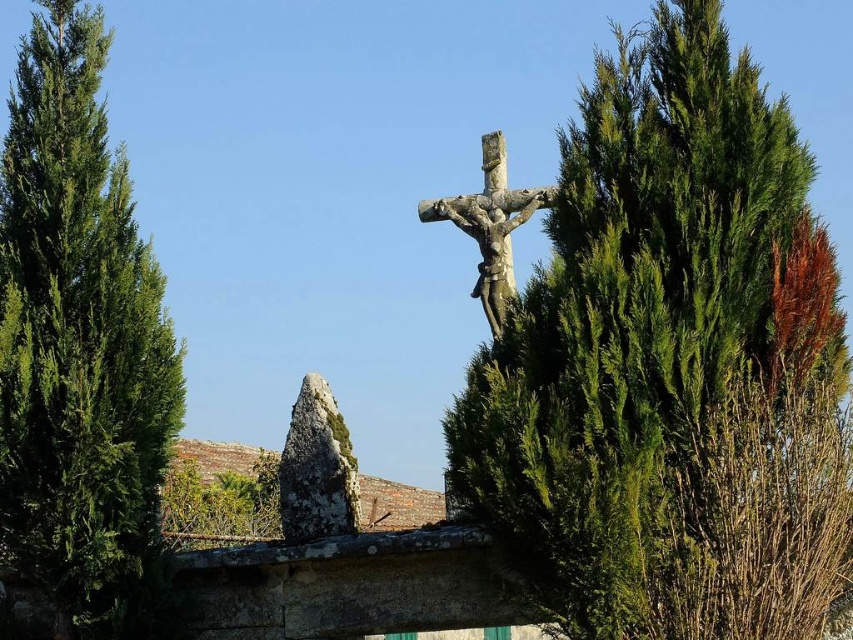
Which is more to the left, rough gray stone at center or stone statue at center?

rough gray stone at center

Which is behind, point (314, 429) or point (482, 266)?

The point (482, 266) is behind.

Locate an element on the screen. This screenshot has width=853, height=640. rough gray stone at center is located at coordinates (316, 467).

Is green textured tree at upper right shorter than stone statue at center?

No, green textured tree at upper right is not shorter than stone statue at center.

Between green textured tree at upper right and stone statue at center, which one is positioned lower?

Positioned lower is green textured tree at upper right.

Is point (805, 164) in front of point (512, 211)?

Yes, it is in front of point (512, 211).

This screenshot has height=640, width=853. Find the location of `green textured tree at upper right`. green textured tree at upper right is located at coordinates (670, 364).

Who is taller, green textured tree at left or rough gray stone at center?

green textured tree at left

Can you confirm if green textured tree at left is bigger than rough gray stone at center?

Indeed, green textured tree at left has a larger size compared to rough gray stone at center.

Between point (24, 468) and point (293, 467), which one is positioned behind?

The point (293, 467) is behind.

In order to click on green textured tree at left in this screenshot , I will do `click(79, 342)`.